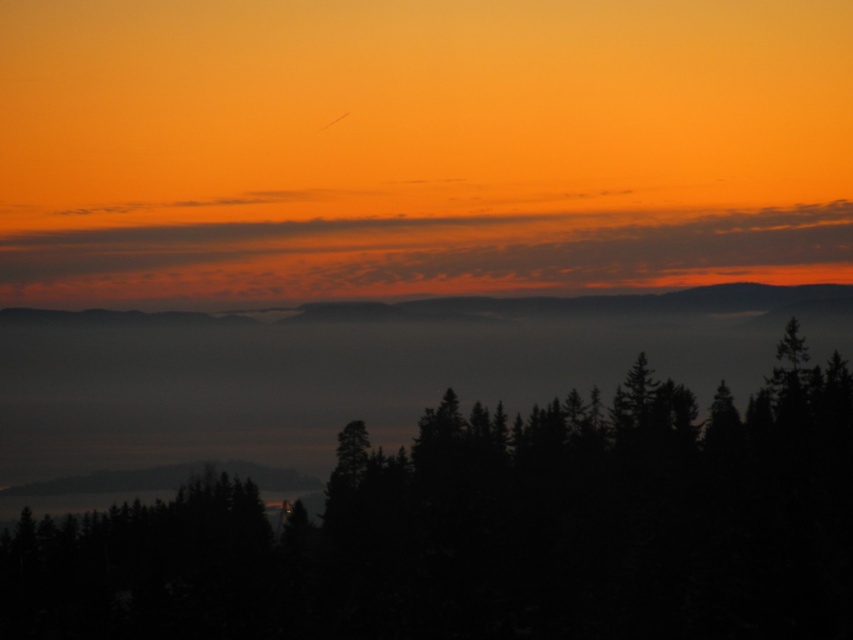
You are an artist trying to paint the sunset scene. You need to decide where to place the dark green textured trees at lower center in relation to the matte orange sky at upper center. According to the scene, which direction should the trees be placed relative to the sky?

The dark green textured trees at lower center should be placed to the left of the matte orange sky at upper center.

You are standing at the center of the image and want to walk towards the dark green textured trees at lower center. Which direction should you move in to reach them?

The dark green textured trees at lower center are located at point 0.830 on the x and 0.577 on the y coordinate. Since you are at the center, you should move towards the lower right direction to reach them.